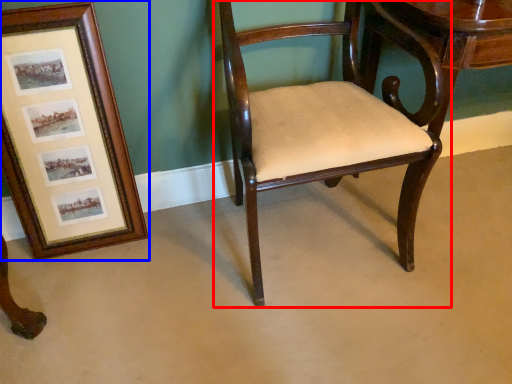
Question: Which object is closer to the camera taking this photo, chair (highlighted by a red box) or picture frame (highlighted by a blue box)?

Choices:
 (A) chair
 (B) picture frame

Answer: (A)